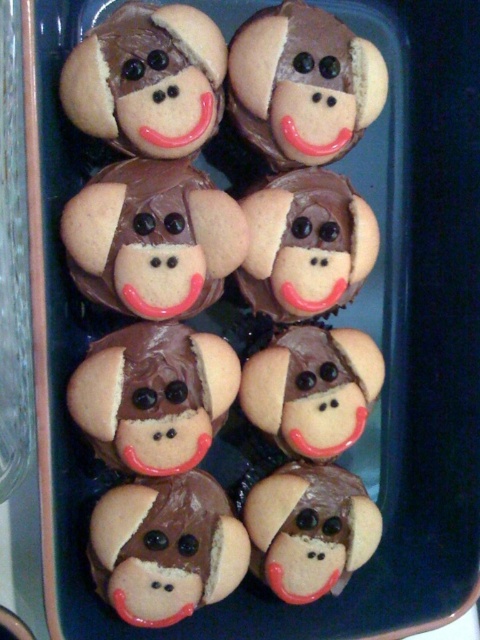
Question: Among these points, which one is nearest to the camera?

Choices:
 (A) (169, 272)
 (B) (282, 74)

Answer: (B)

Question: Is matte chocolate monkey face at center thinner than matte brown cookie at center?

Choices:
 (A) no
 (B) yes

Answer: (A)

Question: Is matte chocolate monkey face at center bigger than matte brown cookie at center?

Choices:
 (A) yes
 (B) no

Answer: (A)

Question: Among these objects, which one is farthest from the camera?

Choices:
 (A) matte chocolate monkey face at center
 (B) matte brown cookie at center

Answer: (B)

Question: Can you confirm if matte chocolate monkey face at center is thinner than matte brown cookie at center?

Choices:
 (A) yes
 (B) no

Answer: (B)